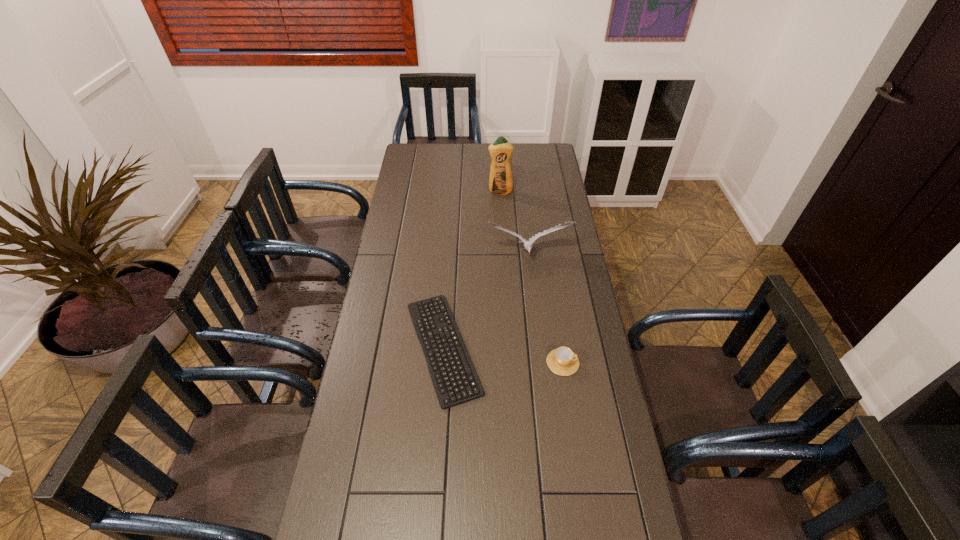
Where is `the farthest object`? Image resolution: width=960 pixels, height=540 pixels. the farthest object is located at coordinates (501, 180).

Find the location of a particular element. The width and height of the screenshot is (960, 540). detergent is located at coordinates (501, 180).

Where is `the third nearest object`? The width and height of the screenshot is (960, 540). the third nearest object is located at coordinates (527, 244).

Where is `gull`? The image size is (960, 540). gull is located at coordinates (527, 244).

This screenshot has height=540, width=960. What are the coordinates of `the third tallest object` in the screenshot? It's located at (562, 361).

Find the location of a particular element. The height and width of the screenshot is (540, 960). the leftmost object is located at coordinates (455, 380).

Image resolution: width=960 pixels, height=540 pixels. What are the coordinates of `the shortest object` in the screenshot? It's located at (455, 380).

Where is `free location located on the label of the farthest object`? free location located on the label of the farthest object is located at coordinates (503, 239).

This screenshot has width=960, height=540. In order to click on vacant space located at the tip of the beak of the third shortest object in this screenshot , I will do `click(535, 329)`.

Identify the location of free space located 0.070m with the handle on the side of the cup. (601, 362).